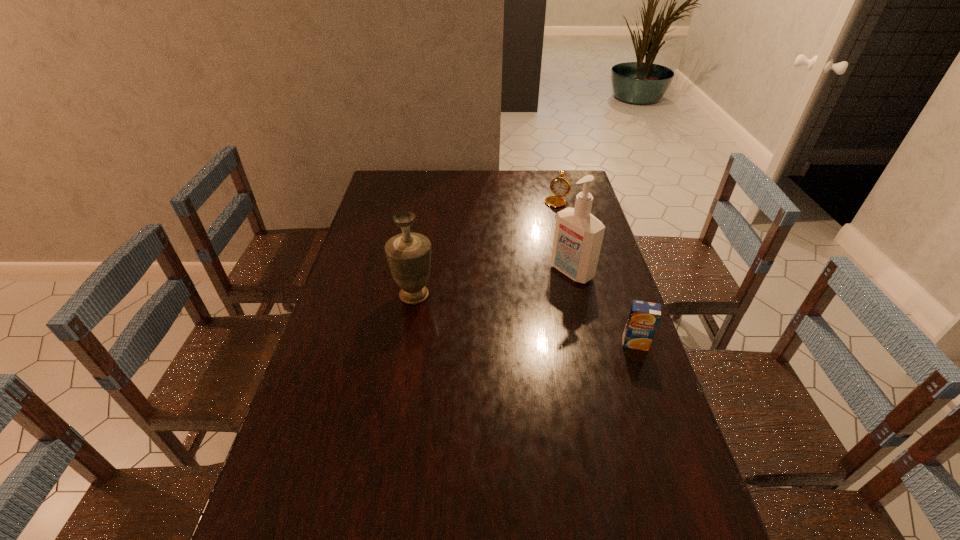
The width and height of the screenshot is (960, 540). In order to click on vacant spot on the desktop that is between the urn and the nearest object and is positioned on the face of the pocket watch in this screenshot , I will do `click(488, 311)`.

Locate an element on the screen. Image resolution: width=960 pixels, height=540 pixels. vacant space on the desktop that is between the third shortest object and the orange_juice and is positioned on the front label of the tallest object is located at coordinates (503, 314).